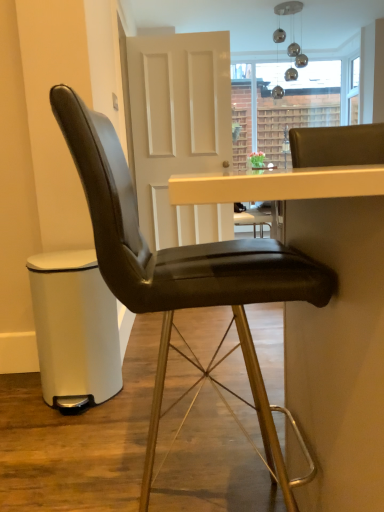
Question: Is matte black bar stool at lower left thinner than black leather table at center?

Choices:
 (A) yes
 (B) no

Answer: (A)

Question: Is matte black bar stool at lower left not within black leather table at center?

Choices:
 (A) yes
 (B) no

Answer: (A)

Question: From a real-world perspective, is matte black bar stool at lower left located higher than black leather table at center?

Choices:
 (A) no
 (B) yes

Answer: (A)

Question: From the image's perspective, does matte black bar stool at lower left appear higher than black leather table at center?

Choices:
 (A) yes
 (B) no

Answer: (B)

Question: Is matte black bar stool at lower left not near black leather table at center?

Choices:
 (A) no
 (B) yes

Answer: (B)

Question: In the image, is matte black bar stool at lower left positioned in front of or behind black leather table at center?

Choices:
 (A) behind
 (B) front

Answer: (A)

Question: From the image's perspective, is matte black bar stool at lower left above or below black leather table at center?

Choices:
 (A) below
 (B) above

Answer: (A)

Question: Considering the positions of matte black bar stool at lower left and black leather table at center in the image, is matte black bar stool at lower left wider or thinner than black leather table at center?

Choices:
 (A) wide
 (B) thin

Answer: (B)

Question: Considering the positions of point (51, 386) and point (274, 185), is point (51, 386) closer or farther from the camera than point (274, 185)?

Choices:
 (A) closer
 (B) farther

Answer: (B)

Question: In terms of size, does black leather chair at center appear bigger or smaller than black leather table at center?

Choices:
 (A) big
 (B) small

Answer: (B)

Question: Which is correct: black leather chair at center is inside black leather table at center, or outside of it?

Choices:
 (A) outside
 (B) inside

Answer: (B)

Question: Considering the positions of black leather chair at center and black leather table at center in the image, is black leather chair at center taller or shorter than black leather table at center?

Choices:
 (A) tall
 (B) short

Answer: (A)

Question: From a real-world perspective, is black leather chair at center positioned above or below black leather table at center?

Choices:
 (A) above
 (B) below

Answer: (A)

Question: In the image, is black leather table at center positioned in front of or behind black leather chair at center?

Choices:
 (A) front
 (B) behind

Answer: (A)

Question: Is black leather table at center wider or thinner than black leather chair at center?

Choices:
 (A) thin
 (B) wide

Answer: (B)